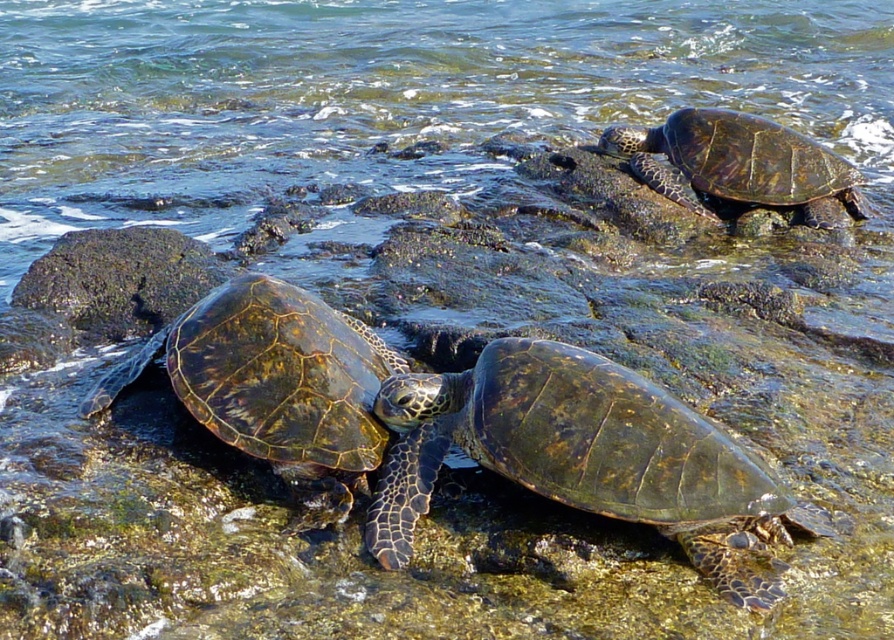
You are a photographer standing at the edge of the shoreline. You want to take a photo of the two points mentioned in the scene. Which point is closer to your camera, point (x=488, y=392) or point (x=631, y=134)?

Point (x=488, y=392) is closer to the camera than point (x=631, y=134).

You are a photographer standing on the shore and want to take a photo of the leathery green turtle at center and the green mossy rock at left. Which object will appear closer to the camera in the photo?

The leathery green turtle at center will appear closer to the camera in the photo because it is positioned in front of the green mossy rock at left.